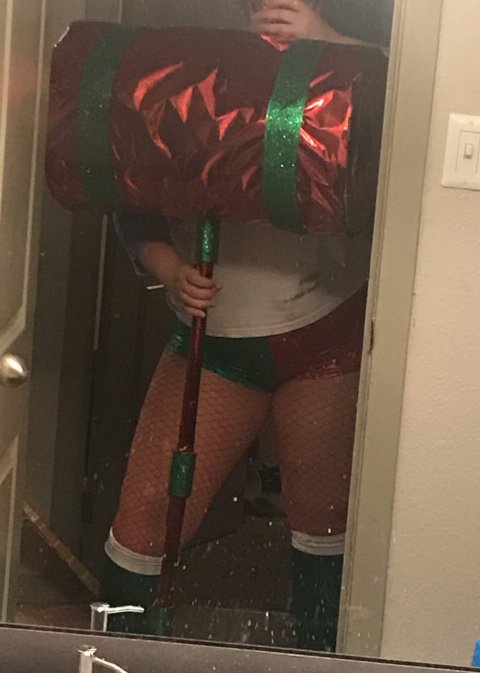
Identify the location of top of soap dispenser. point(86,649).